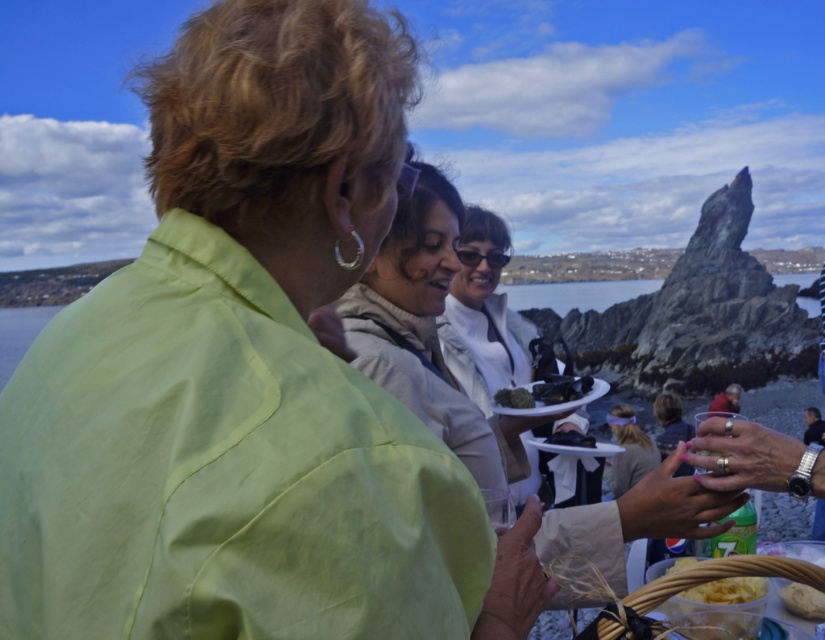
You are standing at the center of the scene. You want to pick up the green leafy vegetable at center without moving from your spot. Is the white matte jacket at center in your way?

The white matte jacket at center is 69.58 feet away from green leafy vegetable at center. Since you are at the center, the white matte jacket at center is between you and the green leafy vegetable at center, so it would be blocking your path. You cannot reach the green leafy vegetable at center without moving.

Looking at the scene, which object is positioned higher between the smooth dark mussels at center and the green leafy vegetable at center?

The smooth dark mussels at center are positioned above the green leafy vegetable at center.